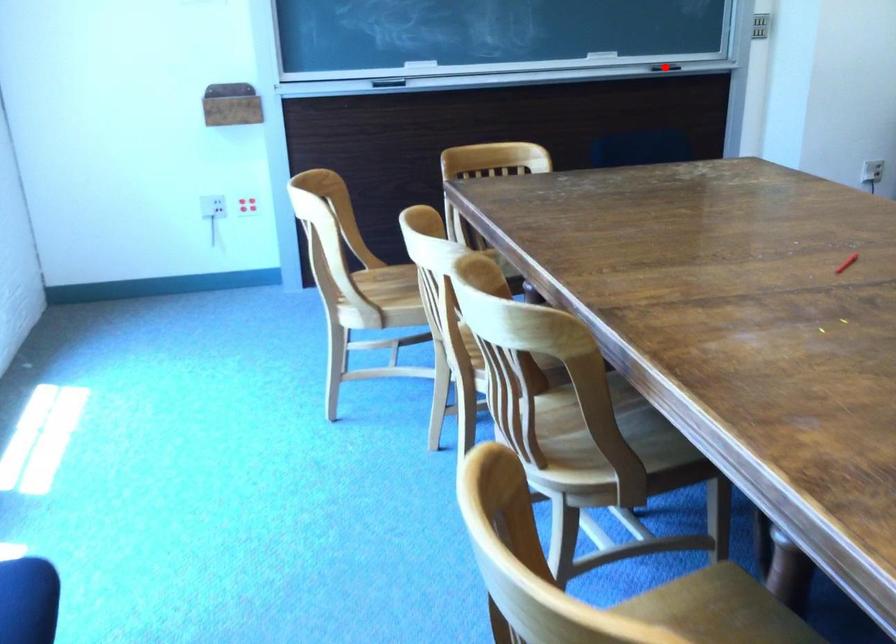
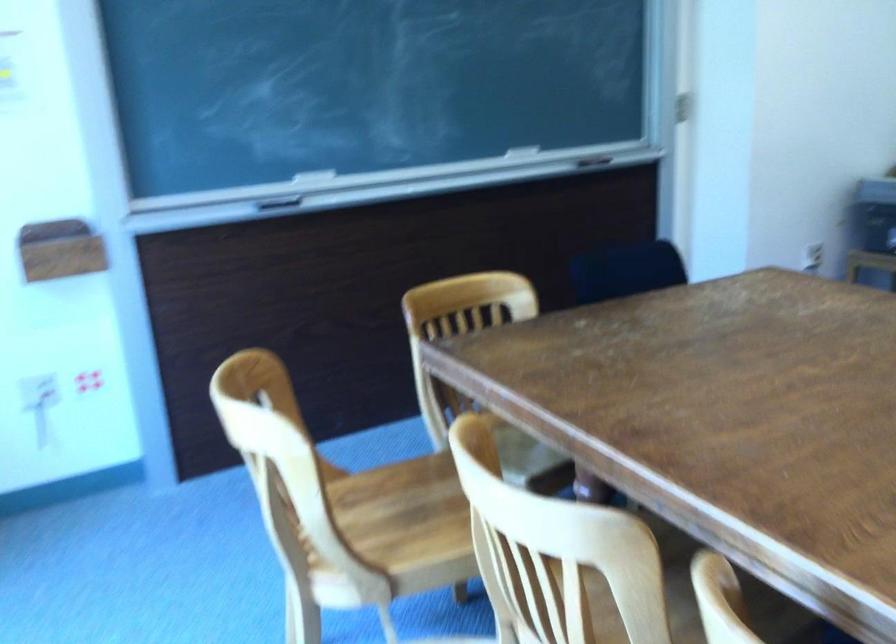
Question: I am providing you with two images of the same scene from different viewpoints. A red point is marked on the first image. Is the red point's position out of view in image 2?

Choices:
 (A) Yes
 (B) No

Answer: (A)